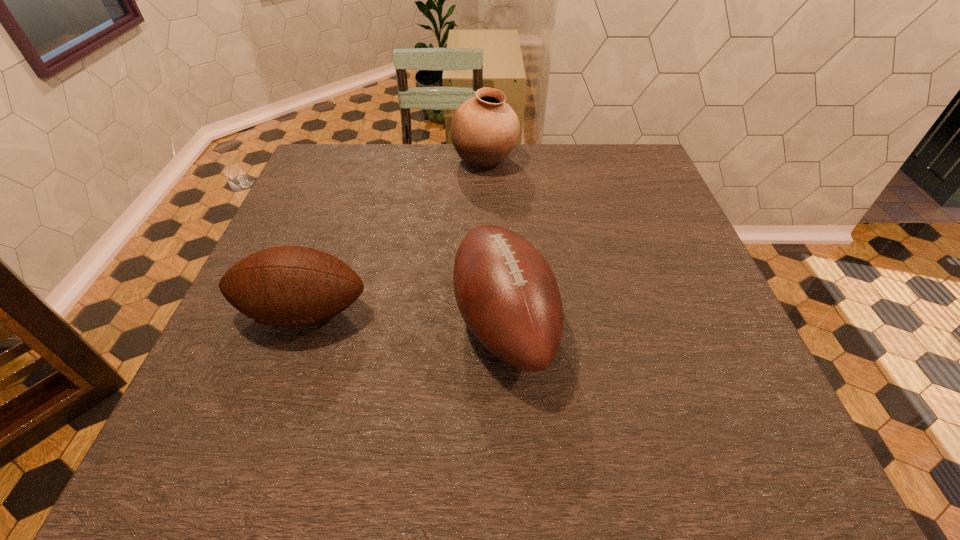
In the image, there is a desktop. At what (x,y) coordinates should I click in order to perform the action: click on free region at the near edge. Please return your answer as a coordinate pair (x, y). The image size is (960, 540). Looking at the image, I should click on (306, 461).

The image size is (960, 540). Find the location of `vacant space at the left edge`. vacant space at the left edge is located at coordinates (257, 403).

Where is `vacant region at the right edge of the desktop`? This screenshot has width=960, height=540. vacant region at the right edge of the desktop is located at coordinates (660, 228).

Locate an element on the screen. vacant area that lies between the right football and the leftmost object is located at coordinates (404, 318).

In order to click on unoccupied area between the pottery and the left football in this screenshot , I will do `click(395, 237)`.

The width and height of the screenshot is (960, 540). In order to click on vacant space that's between the leftmost object and the pottery in this screenshot , I will do `click(395, 237)`.

Where is `free space between the pottery and the shortest object`? The image size is (960, 540). free space between the pottery and the shortest object is located at coordinates (395, 237).

Image resolution: width=960 pixels, height=540 pixels. Find the location of `free space between the pottery and the left football`. free space between the pottery and the left football is located at coordinates (395, 237).

This screenshot has height=540, width=960. Find the location of `vacant area between the pottery and the left football`. vacant area between the pottery and the left football is located at coordinates (395, 237).

You are a GUI agent. You are given a task and a screenshot of the screen. Output one action in this format:
    pyautogui.click(x=<x>, y=<y>)
    Task: Click on the free spot between the taller football and the shorter football
    
    Given the screenshot: What is the action you would take?
    pyautogui.click(x=404, y=318)